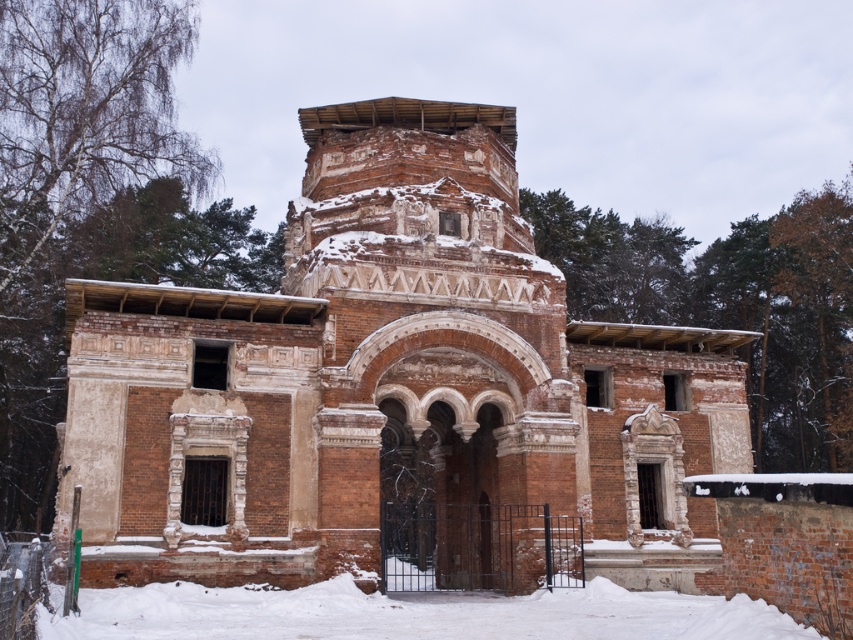
This screenshot has height=640, width=853. Describe the element at coordinates (392, 385) in the screenshot. I see `reddish-brown brick church at center` at that location.

Between point (434, 353) and point (364, 634), which one is positioned in front?

Positioned in front is point (364, 634).

You are a GUI agent. You are given a task and a screenshot of the screen. Output one action in this format:
    pyautogui.click(x=<x>, y=<y>)
    Task: Click on the reddish-brown brick church at center
    The width and height of the screenshot is (853, 640).
    Given the screenshot: What is the action you would take?
    pyautogui.click(x=392, y=385)